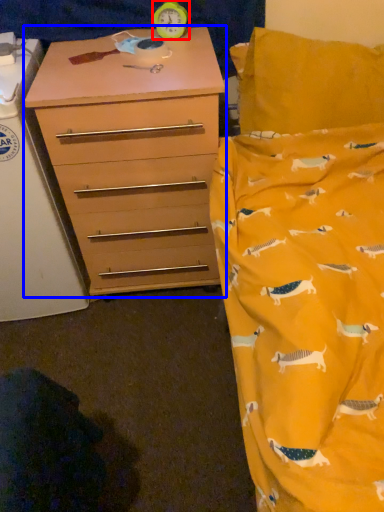
Question: Among these objects, which one is farthest to the camera, clock (highlighted by a red box) or chest of drawers (highlighted by a blue box)?

Choices:
 (A) clock
 (B) chest of drawers

Answer: (A)